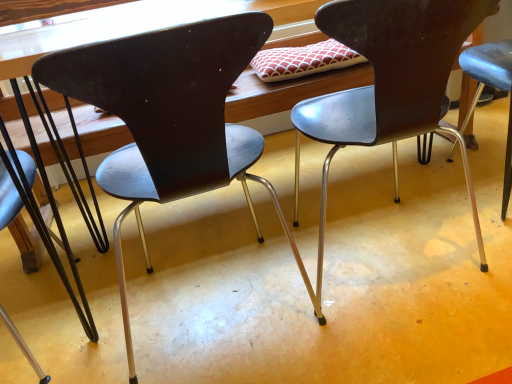
The width and height of the screenshot is (512, 384). I want to click on free space in front of metallic black chair at center, acting as the 1th chair starting from the right, so click(x=410, y=330).